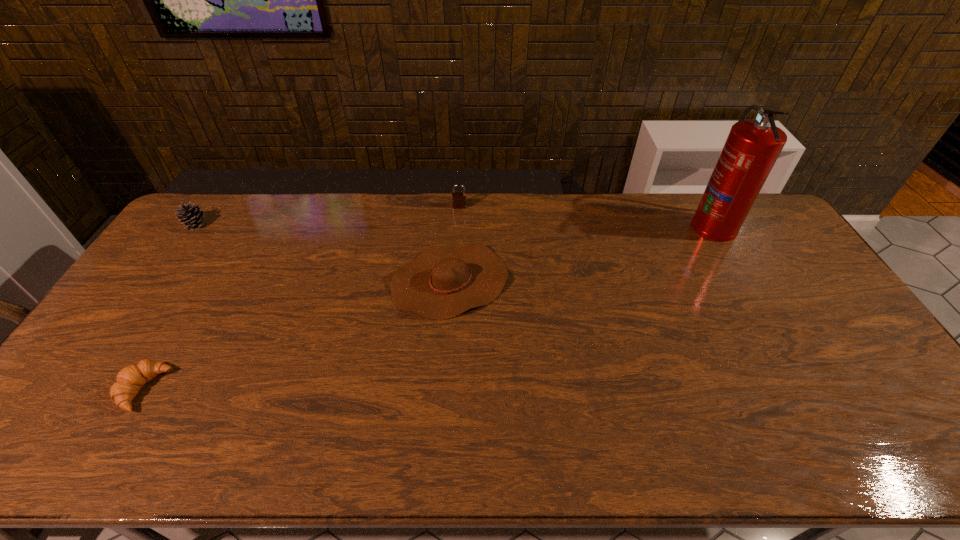
Locate an element on the screen. Image resolution: width=960 pixels, height=540 pixels. vacant space that is in between the nearest object and the pinecone is located at coordinates (170, 307).

Locate an element on the screen. The height and width of the screenshot is (540, 960). free space between the fourth tallest object and the tallest object is located at coordinates (582, 253).

Locate an element on the screen. empty space between the fourth tallest object and the tallest object is located at coordinates (582, 253).

This screenshot has height=540, width=960. Find the location of `vacant point located between the padlock and the leftmost object`. vacant point located between the padlock and the leftmost object is located at coordinates (327, 216).

Find the location of a particular element. blank region between the fourth tallest object and the shortest object is located at coordinates (297, 335).

Image resolution: width=960 pixels, height=540 pixels. I want to click on free space between the fourth tallest object and the crescent roll, so click(297, 335).

This screenshot has height=540, width=960. Identify the location of blank region between the leftmost object and the fourth farthest object. (324, 253).

In order to click on object that is the second closest to the leftmost object in this screenshot , I will do `click(442, 282)`.

Locate which object ranks in proximity to the tallest object. Please provide its 2D coordinates. Your answer should be formatted as a tuple, i.e. [(x, y)], where the tuple contains the x and y coordinates of a point satisfying the conditions above.

[(442, 282)]

The image size is (960, 540). I want to click on free space that satisfies the following two spatial constraints: 1. on the front side of the fourth tallest object; 2. on the right side of the pinecone, so click(x=156, y=281).